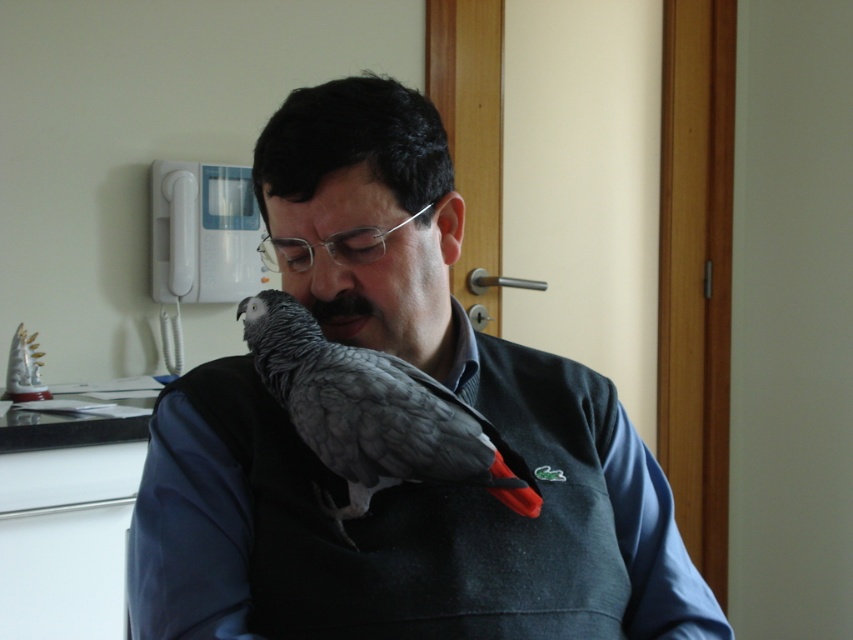
You are an interior designer assessing the space for a new shelf. The shelf must accommodate both the matte gray bird at center and the gray matte parrot at center. Which object requires a taller shelf?

The matte gray bird at center requires a taller shelf because it has a greater height compared to the gray matte parrot at center.